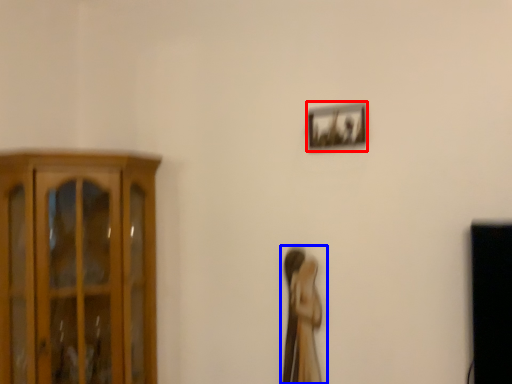
Question: Which object is closer to the camera taking this photo, picture frame (highlighted by a red box) or woman (highlighted by a blue box)?

Choices:
 (A) picture frame
 (B) woman

Answer: (A)